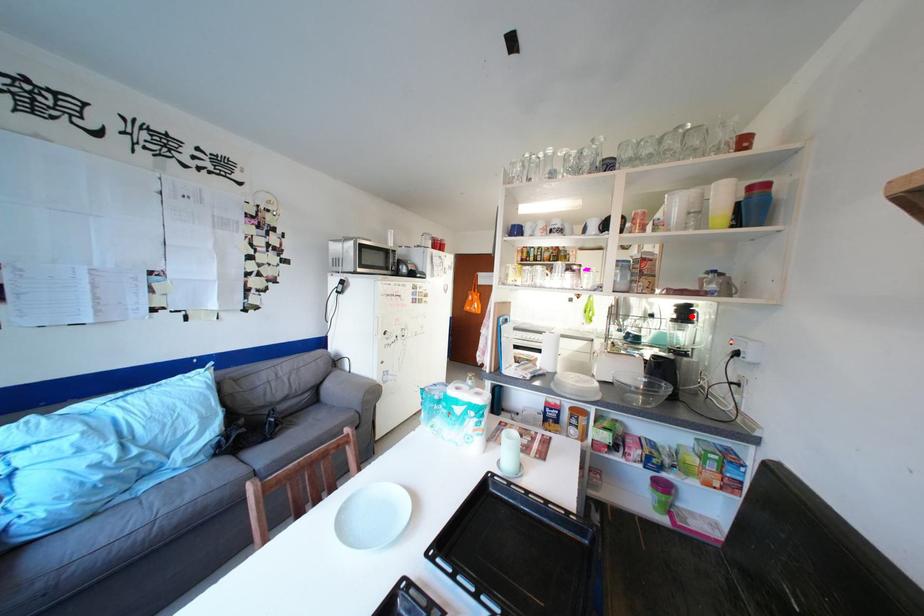
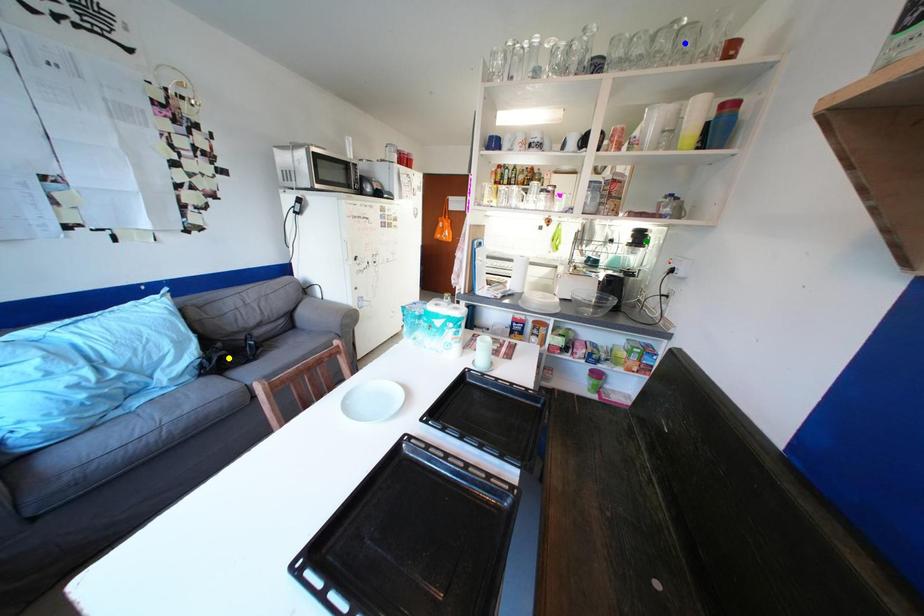
Question: I am providing you with two images of the same scene from different viewpoints. A red point is marked on the first image. You are given multiple points on the second image. Which spot in image 2 lines up with the point in image 1?

Choices:
 (A) blue point
 (B) green point
 (C) yellow point

Answer: (B)